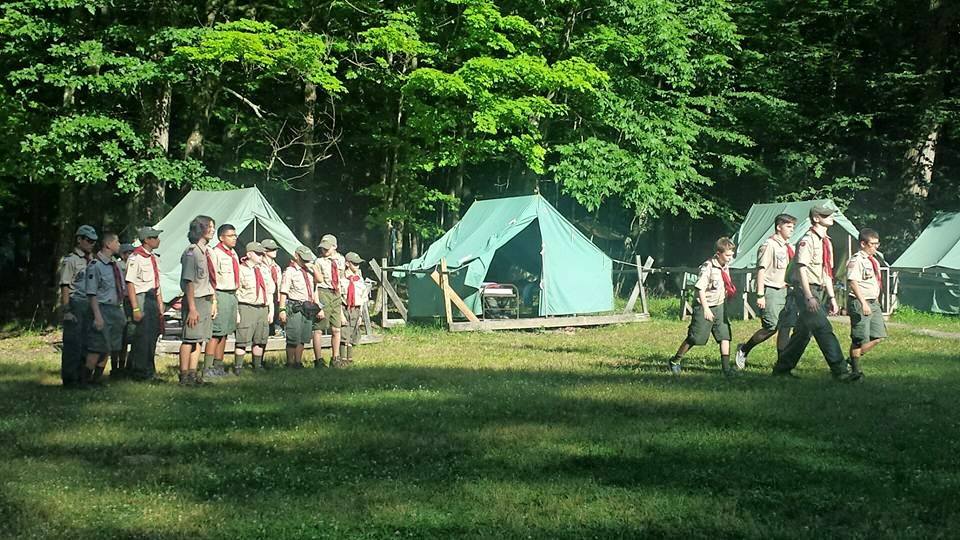
What are the coordinates of `cot` in the screenshot? It's located at (496, 295).